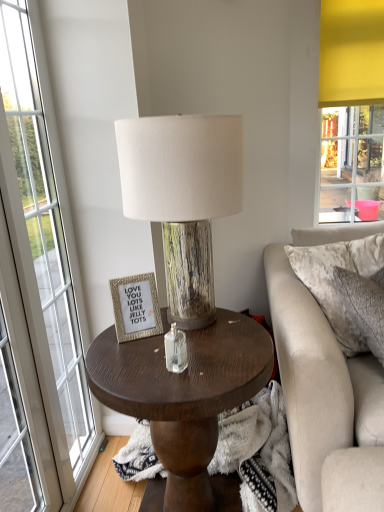
What do you see at coordinates (37, 296) in the screenshot? I see `transparent glass window at left` at bounding box center [37, 296].

What is the approximate width of transparent glass window at left?

17.05 centimeters.

Image resolution: width=384 pixels, height=512 pixels. What do you see at coordinates (183, 394) in the screenshot? I see `dark wood coffee table at center` at bounding box center [183, 394].

Locate an element on the screen. This screenshot has width=384, height=512. transparent glass window at left is located at coordinates (37, 296).

Considering the sizes of objects wood grain lampshade at center and dark wood coffee table at center in the image provided, who is thinner, wood grain lampshade at center or dark wood coffee table at center?

wood grain lampshade at center is thinner.

Image resolution: width=384 pixels, height=512 pixels. I want to click on coffee table to the right of wood grain lampshade at center, so [183, 394].

Considering the positions of points (205, 128) and (245, 366), is point (205, 128) farther from camera compared to point (245, 366)?

No, (205, 128) is closer to viewer.

From the image's perspective, is wood grain lampshade at center positioned above or below dark wood coffee table at center?

Based on their image positions, wood grain lampshade at center is located above dark wood coffee table at center.

From a real-world perspective, is dark wood coffee table at center positioned above or below velvet beige pillow at right?

From a real-world perspective, dark wood coffee table at center is physically below velvet beige pillow at right.

Is dark wood coffee table at center taller than velvet beige pillow at right?

Yes, dark wood coffee table at center is taller than velvet beige pillow at right.

Between dark wood coffee table at center and velvet beige pillow at right, which one has larger width?

dark wood coffee table at center.

Are dark wood coffee table at center and velvet beige pillow at right located far from each other?

No, dark wood coffee table at center is not far from velvet beige pillow at right.

From a real-world perspective, between velvet beige pillow at right and gold textured picture frame at upper center, who is vertically higher?

gold textured picture frame at upper center.

Looking at this image, which of these two, velvet beige pillow at right or gold textured picture frame at upper center, stands shorter?

Standing shorter between the two is gold textured picture frame at upper center.

Does velvet beige pillow at right have a greater width compared to gold textured picture frame at upper center?

Indeed, velvet beige pillow at right has a greater width compared to gold textured picture frame at upper center.

Is velvet beige pillow at right situated inside gold textured picture frame at upper center or outside?

velvet beige pillow at right exists outside the volume of gold textured picture frame at upper center.

From a real-world perspective, between wood grain lampshade at center and gold textured picture frame at upper center, who is vertically higher?

wood grain lampshade at center.

Is wood grain lampshade at center located outside gold textured picture frame at upper center?

Indeed, wood grain lampshade at center is completely outside gold textured picture frame at upper center.

Which object is closer to the camera taking this photo, wood grain lampshade at center or gold textured picture frame at upper center?

wood grain lampshade at center is more forward.

Is wood grain lampshade at center turned away from gold textured picture frame at upper center?

That's not correct — wood grain lampshade at center is not looking away from gold textured picture frame at upper center.

Could you tell me if wood grain lampshade at center is turned towards transparent glass window at left?

No, wood grain lampshade at center does not turn towards transparent glass window at left.

In the scene shown: From a real-world perspective, which object stands above the other?

From a 3D spatial view, wood grain lampshade at center is above.

Which is in front, wood grain lampshade at center or transparent glass window at left?

wood grain lampshade at center is more forward.

From the image's perspective, between wood grain lampshade at center and transparent glass window at left, which one is located above?

wood grain lampshade at center.

Based on the photo, which is nearer, (8,169) or (324,278)?

Point (8,169) is positioned closer to the camera compared to point (324,278).

Who is smaller, transparent glass window at left or velvet beige pillow at right?

velvet beige pillow at right.

In the scene shown: Relative to velvet beige pillow at right, is transparent glass window at left in front or behind?

Visually, transparent glass window at left is located in front of velvet beige pillow at right.

From a real-world perspective, is transparent glass window at left physically below velvet beige pillow at right?

No.

Based on the photo, is gold textured picture frame at upper center with velvet beige pillow at right?

gold textured picture frame at upper center and velvet beige pillow at right are clearly separated.

Can you confirm if gold textured picture frame at upper center is shorter than velvet beige pillow at right?

Yes, gold textured picture frame at upper center is shorter than velvet beige pillow at right.

Who is more distant, gold textured picture frame at upper center or velvet beige pillow at right?

Positioned behind is velvet beige pillow at right.

This screenshot has width=384, height=512. I want to click on lamp above the dark wood coffee table at center (from the image's perspective), so click(183, 196).

Where is `pillow that appears on the right of dark wood coffee table at center`? The height and width of the screenshot is (512, 384). pillow that appears on the right of dark wood coffee table at center is located at coordinates 336,282.

Considering their positions, is velvet beige pillow at right positioned further to dark wood coffee table at center than wood grain lampshade at center?

Among the two, velvet beige pillow at right is located further to dark wood coffee table at center.

Looking at the image, which one is located further to gold textured picture frame at upper center, dark wood coffee table at center or transparent glass window at left?

transparent glass window at left lies further to gold textured picture frame at upper center than the other object.

When comparing their distances from wood grain lampshade at center, does dark wood coffee table at center or transparent glass window at left seem closer?

The object closer to wood grain lampshade at center is dark wood coffee table at center.

Looking at the image, which one is located further to gold textured picture frame at upper center, velvet beige pillow at right or dark wood coffee table at center?

The object further to gold textured picture frame at upper center is velvet beige pillow at right.

From the image, which object appears to be nearer to dark wood coffee table at center, wood grain lampshade at center or velvet beige pillow at right?

wood grain lampshade at center lies closer to dark wood coffee table at center than the other object.

Considering their positions, is gold textured picture frame at upper center positioned closer to dark wood coffee table at center than wood grain lampshade at center?

Among the two, gold textured picture frame at upper center is located nearer to dark wood coffee table at center.

Which object lies nearer to the anchor point transparent glass window at left, velvet beige pillow at right or dark wood coffee table at center?

dark wood coffee table at center is closer to transparent glass window at left.

Looking at the image, which one is located further to wood grain lampshade at center, dark wood coffee table at center or velvet beige pillow at right?

velvet beige pillow at right is positioned further to the anchor wood grain lampshade at center.

Where is `picture frame between transparent glass window at left and dark wood coffee table at center vertically`? picture frame between transparent glass window at left and dark wood coffee table at center vertically is located at coordinates (135, 307).

Locate an element on the screen. This screenshot has height=512, width=384. coffee table between wood grain lampshade at center and velvet beige pillow at right in the horizontal direction is located at coordinates (183, 394).

Where is `lamp between gold textured picture frame at upper center and velvet beige pillow at right from left to right`? The height and width of the screenshot is (512, 384). lamp between gold textured picture frame at upper center and velvet beige pillow at right from left to right is located at coordinates (183, 196).

Where is `picture frame between transparent glass window at left and wood grain lampshade at center`? picture frame between transparent glass window at left and wood grain lampshade at center is located at coordinates (135, 307).